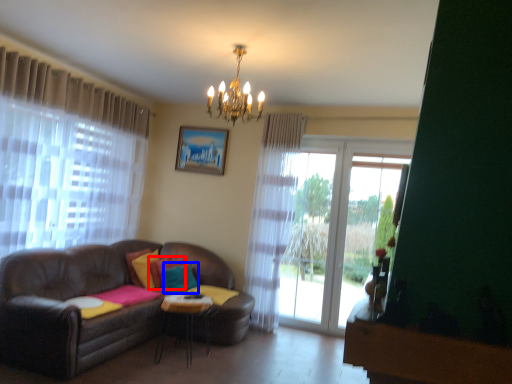
Question: Which point is closer to the camera, pillow (highlighted by a red box) or pillow (highlighted by a blue box)?

Choices:
 (A) pillow
 (B) pillow

Answer: (B)